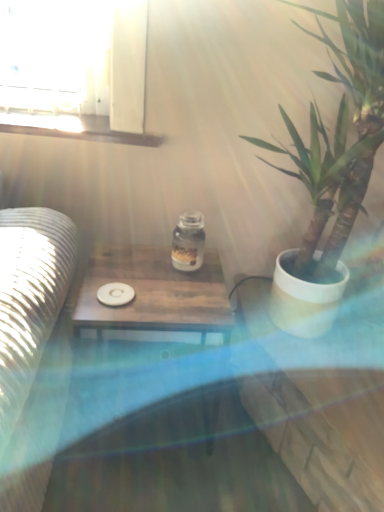
Where is `free space in front of transparent glass jar at center`? free space in front of transparent glass jar at center is located at coordinates (178, 294).